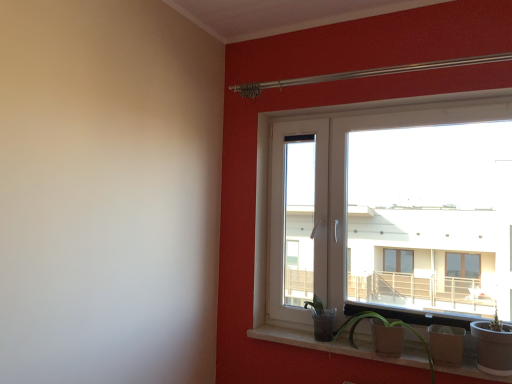
The height and width of the screenshot is (384, 512). Identify the location of free space above white plastic window at upper right (from a real-world perspective). (394, 106).